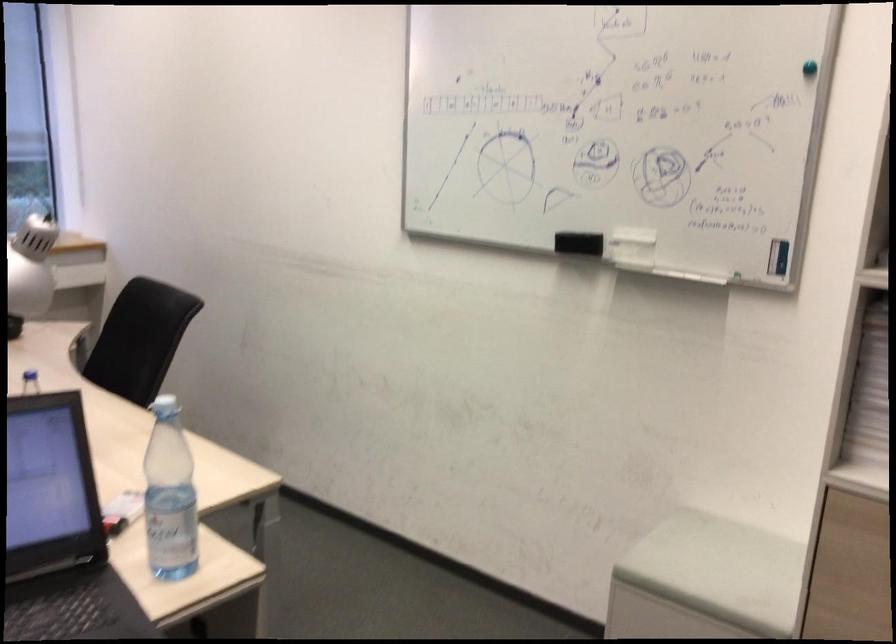
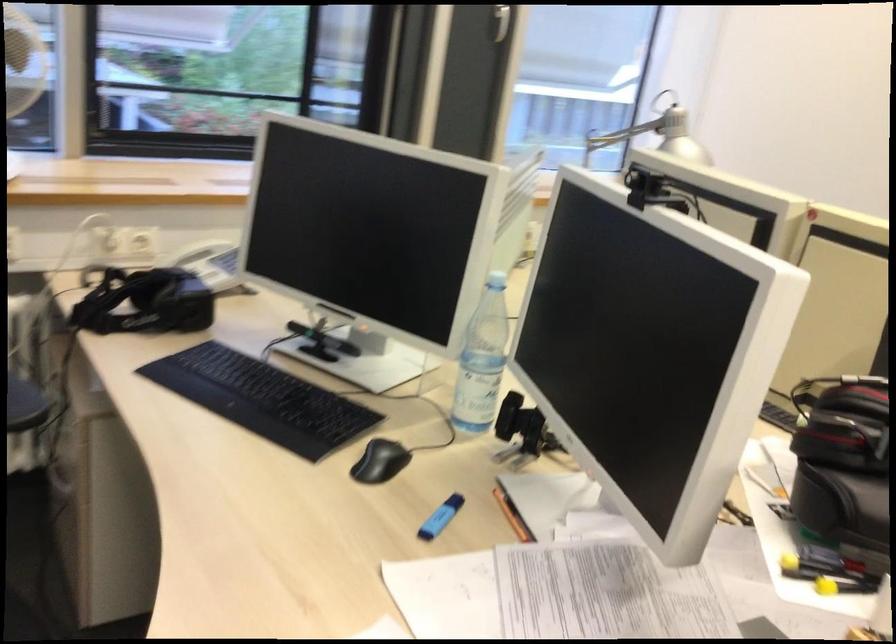
Question: Which direction would the cameraman need to move to produce the second image? Reply with the corresponding letter.

Choices:
 (A) Left
 (B) Right
 (C) Forward
 (D) Backward

Answer: (A)